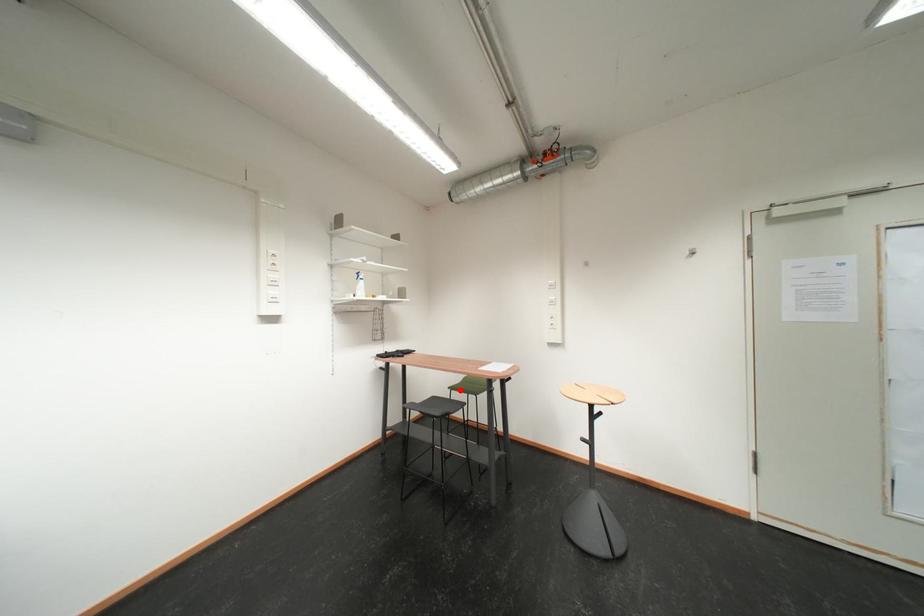
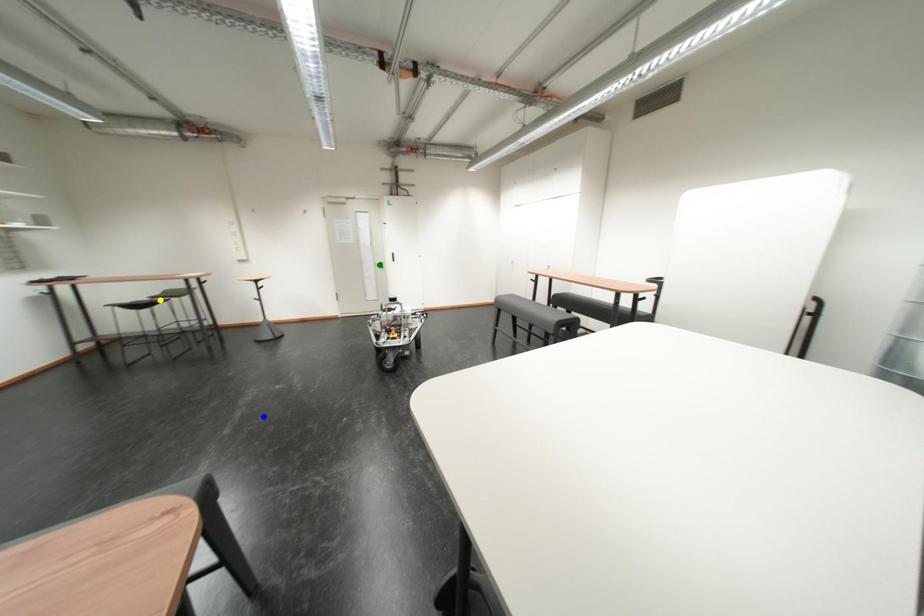
Question: I am providing you with two images of the same scene from different viewpoints. A red point is marked on the first image. You are given multiple points on the second image. Which spot in image 2 lines up with the point in image 1?

Choices:
 (A) yellow point
 (B) green point
 (C) blue point

Answer: (A)